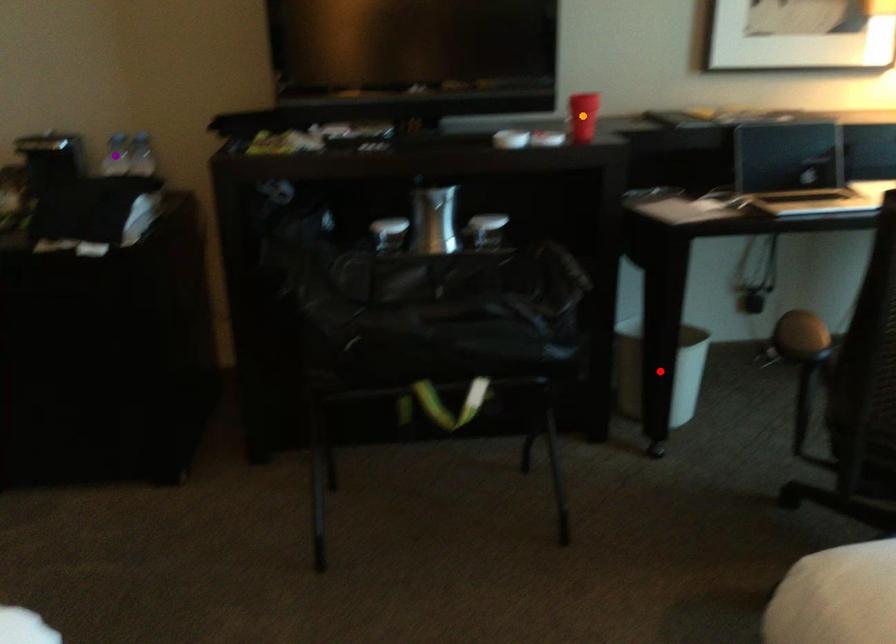
Order these from nearest to farthest:
A) purple point
B) orange point
C) red point

1. orange point
2. purple point
3. red point